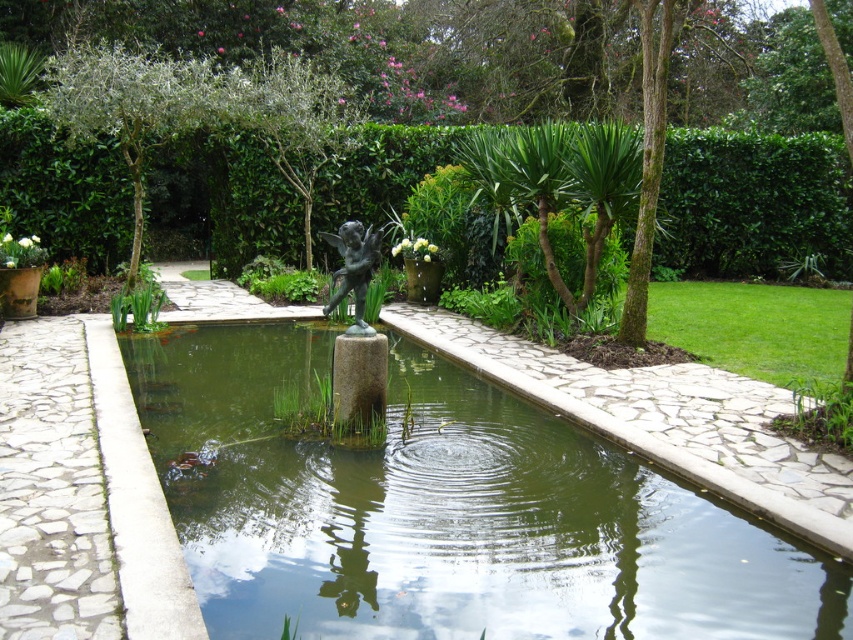
You are a landscape architect designing a garden. You have a green stone pond at center and a bronze statue at center. Which object is taller?

The bronze statue at center is taller than the green stone pond at center.

You are designing a miniature model of this garden scene for a scale model competition. The competition requires all objects to be scaled down proportionally. If the bronze statue at center in the original is 1 meter tall, what should be the height of the green stone pond at center in the model if the scale is 1 cm to 1 meter?

The green stone pond at center is larger in size than the bronze statue at center. Since the bronze statue is 1 meter tall in the original, and the scale is 1 cm to 1 meter, the statue would be 1 cm tall in the model. However, because the pond is larger, its scaled height must be greater than 1 cm. The exact height depends on the original size ratio between the pond and the statue, but the model pond must be proportionally larger than the 1 cm statue.

You are a gardener who needs to place a 3.5 meter long wooden bridge across the green stone pond at center and bronze statue at center. Can you fit the bridge between them?

The green stone pond at center and bronze statue at center are 2.84 meters apart from each other. The bridge is 3.5 meters long, which is longer than the distance between them, so it cannot be placed between them.